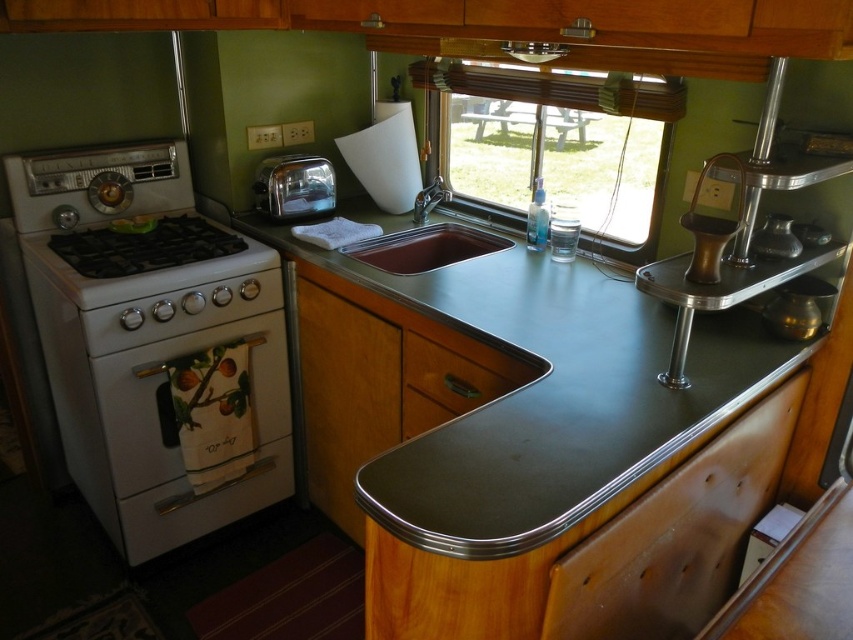
Can you confirm if metallic gray countertop at center is positioned below white glossy gas stove at left?

Indeed, metallic gray countertop at center is positioned under white glossy gas stove at left.

Does point (792, 362) lie behind point (209, 221)?

No, it is in front of (209, 221).

The width and height of the screenshot is (853, 640). What are the coordinates of `metallic gray countertop at center` in the screenshot? It's located at (502, 392).

Between white glossy stove at left and stainless steel sink at center, which one is positioned higher?

stainless steel sink at center

Between point (225, 524) and point (440, 228), which one is positioned behind?

Positioned behind is point (440, 228).

Identify the location of white glossy stove at left. This screenshot has height=640, width=853. click(154, 342).

Describe the element at coordinates (426, 241) in the screenshot. I see `stainless steel sink at center` at that location.

Does stainless steel sink at center appear under polished chrome toaster at center?

Yes, stainless steel sink at center is below polished chrome toaster at center.

Is point (448, 232) less distant than point (276, 186)?

That is False.

Locate an element on the screen. stainless steel sink at center is located at coordinates click(426, 241).